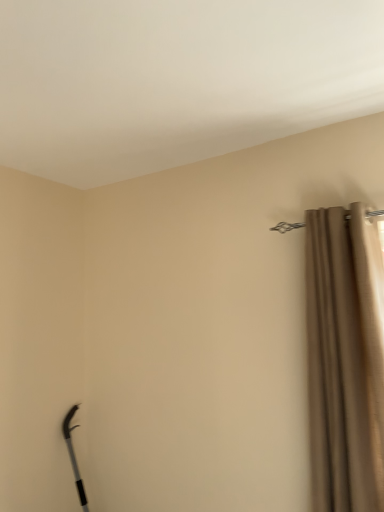
Describe the element at coordinates (339, 374) in the screenshot. I see `brown velvet curtain at right` at that location.

The height and width of the screenshot is (512, 384). What are the coordinates of `brown velvet curtain at right` in the screenshot? It's located at (339, 374).

The image size is (384, 512). I want to click on brown velvet curtain at right, so click(x=339, y=374).